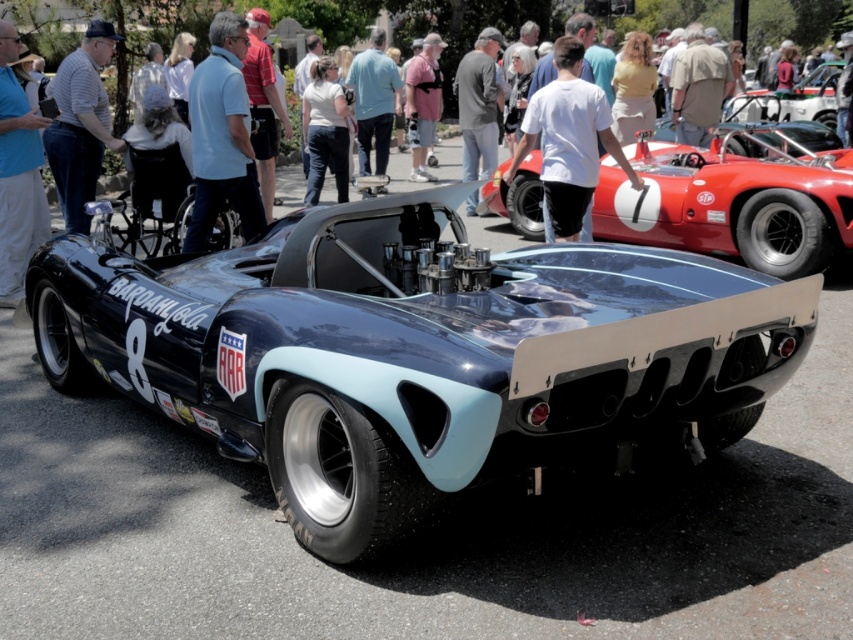
Question: Which object is positioned farthest from the pink fabric at center?

Choices:
 (A) light blue shirt at center
 (B) red cotton shirt at upper center
 (C) shiny blue racing car at center

Answer: (A)

Question: Which point is farther from the camera taking this photo?

Choices:
 (A) click(254, 19)
 (B) click(192, 218)
 (C) click(343, 113)

Answer: (C)

Question: Does matte black car at center appear on the right side of white matte shirt at center?

Choices:
 (A) no
 (B) yes

Answer: (B)

Question: Which point is farther to the camera?

Choices:
 (A) matte black race car at upper right
 (B) shiny blue racing car at center

Answer: (A)

Question: Does shiny blue racing car at center appear on the left side of white matte shirt at center?

Choices:
 (A) yes
 (B) no

Answer: (B)

Question: From the image, what is the correct spatial relationship of shiny blue racing car at center in relation to matte black car at center?

Choices:
 (A) below
 (B) above

Answer: (A)